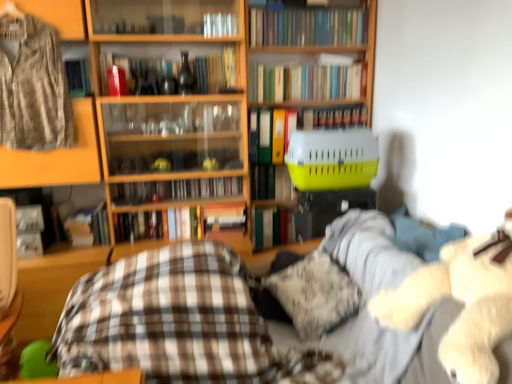
Locate an element on the screen. Image resolution: width=512 pixels, height=384 pixels. vacant space situated above hardcover books at upper center, acting as the 2th book starting from the top (from a real-world perspective) is located at coordinates (308, 61).